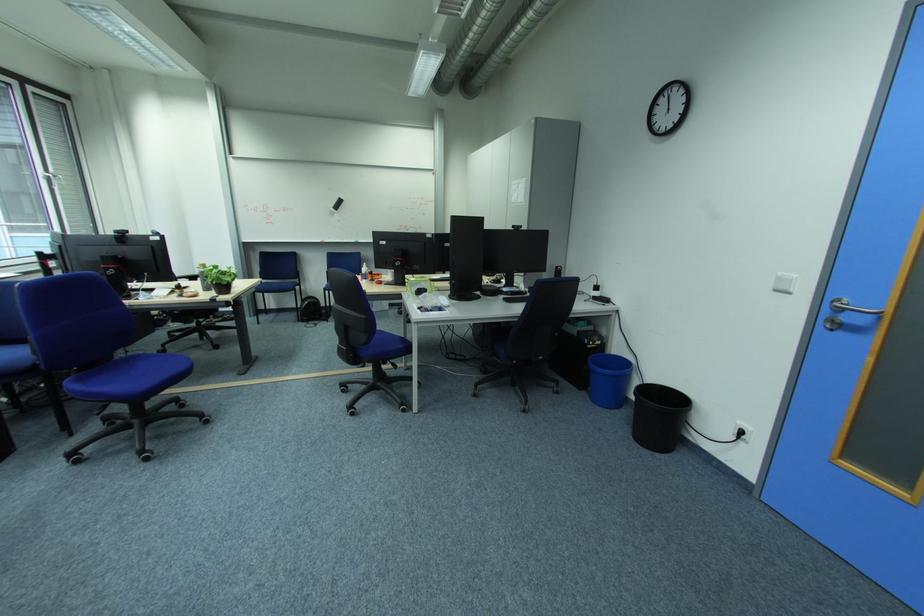
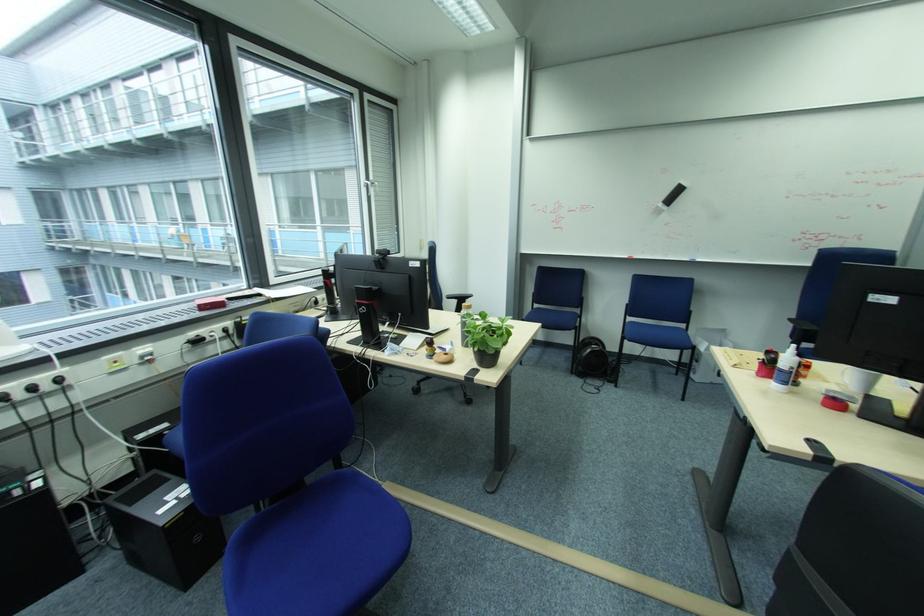
Locate, in the second image, the point that corresponds to point (237, 275) in the first image.

(508, 333)